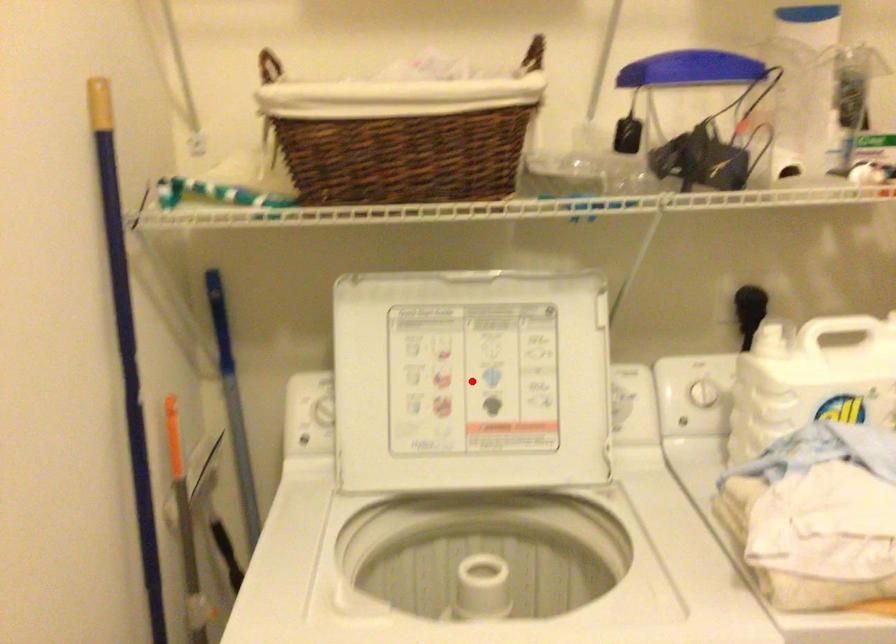
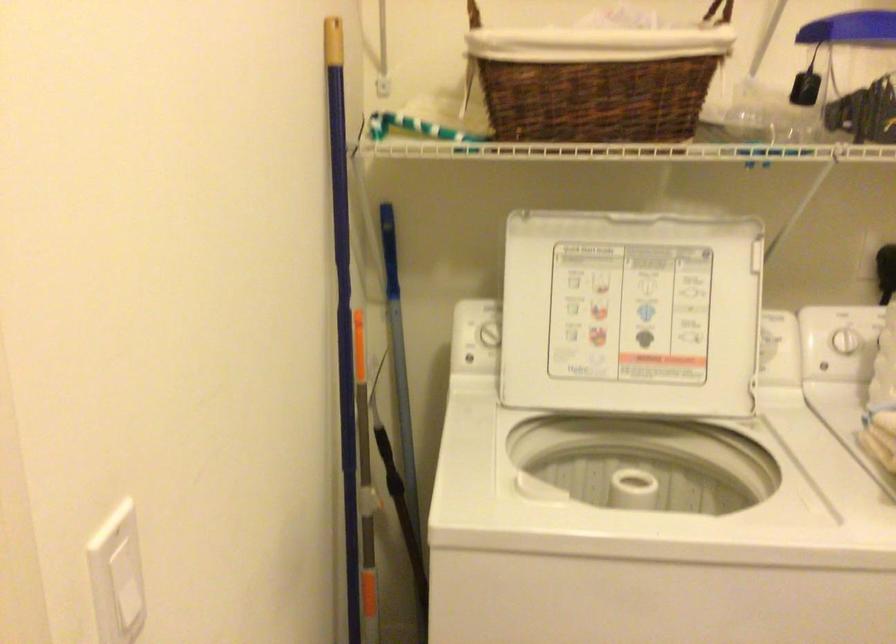
In the second image, find the point that corresponds to the highlighted location in the first image.

(631, 313)